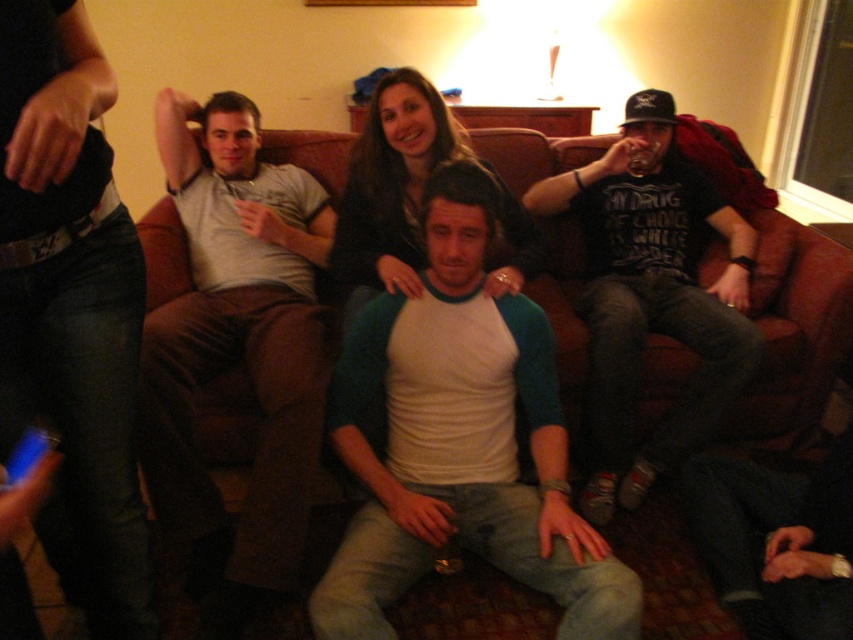
Question: Which of the following is the farthest from the observer?

Choices:
 (A) white jersey at center
 (B) dark gray t-shirt at right
 (C) matte gray pants at center

Answer: (B)

Question: Can you confirm if white jersey at center is bigger than dark gray t-shirt at right?

Choices:
 (A) yes
 (B) no

Answer: (B)

Question: Which object is closer to the camera taking this photo?

Choices:
 (A) white jersey at center
 (B) dark gray t-shirt at right
 (C) brown leather couch at center
 (D) matte gray pants at center

Answer: (D)

Question: Is white jersey at center to the left of dark gray t-shirt at right from the viewer's perspective?

Choices:
 (A) no
 (B) yes

Answer: (B)

Question: Which object is closer to the camera taking this photo?

Choices:
 (A) white jersey at center
 (B) brown leather couch at center
 (C) matte gray pants at center

Answer: (C)

Question: Does matte gray pants at center lie in front of brown leather couch at center?

Choices:
 (A) no
 (B) yes

Answer: (B)